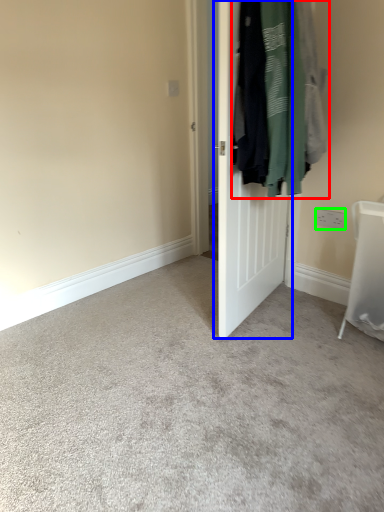
Question: Which is farther away from laundry (highlighted by a red box)? door (highlighted by a blue box) or electric outlet (highlighted by a green box)?

Choices:
 (A) door
 (B) electric outlet

Answer: (B)